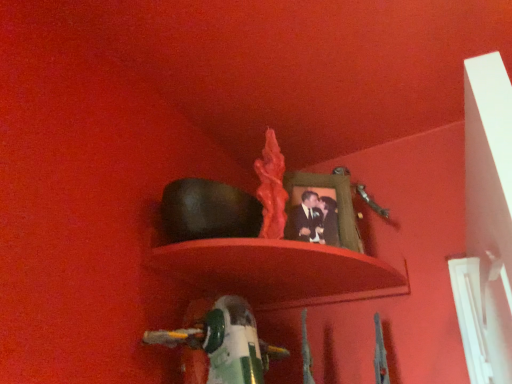
What do you see at coordinates (321, 210) in the screenshot?
I see `matte green picture frame at upper center` at bounding box center [321, 210].

You are a GUI agent. You are given a task and a screenshot of the screen. Output one action in this format:
    pyautogui.click(x=<x>, y=<y>)
    Task: Click on the green plastic toy at lower center
    This screenshot has height=384, width=512.
    Given the screenshot: What is the action you would take?
    pyautogui.click(x=220, y=343)

Does matte green picture frame at upper center come behind green plastic toy at lower center?

Yes.

From the image's perspective, which is below, matte green picture frame at upper center or green plastic toy at lower center?

green plastic toy at lower center, from the image's perspective.

Which object is positioned more to the left, matte green picture frame at upper center or green plastic toy at lower center?

green plastic toy at lower center.

From a real-world perspective, is matte green picture frame at upper center positioned over green plastic toy at lower center based on gravity?

Yes, from a real-world perspective, matte green picture frame at upper center is above green plastic toy at lower center.

Is smooth matte shelf at center oriented towards green plastic toy at lower center?

No, smooth matte shelf at center does not turn towards green plastic toy at lower center.

Which of these two, smooth matte shelf at center or green plastic toy at lower center, stands taller?

green plastic toy at lower center.

Considering the points (290, 201) and (216, 322), which point is in front, point (290, 201) or point (216, 322)?

The point (216, 322) is in front.

In order to click on toy below the matte green picture frame at upper center (from a real-world perspective) in this screenshot , I will do `click(220, 343)`.

From the image's perspective, is green plastic toy at lower center above or below matte green picture frame at upper center?

Based on their image positions, green plastic toy at lower center is located beneath matte green picture frame at upper center.

Which of these two, green plastic toy at lower center or matte green picture frame at upper center, stands shorter?

Result: Standing shorter between the two is green plastic toy at lower center.

Which is more to the right, green plastic toy at lower center or matte green picture frame at upper center?

From the viewer's perspective, matte green picture frame at upper center appears more on the right side.

Is matte green picture frame at upper center not close to smooth matte shelf at center?

matte green picture frame at upper center is near smooth matte shelf at center, not far away.

From the image's perspective, which object appears higher, matte green picture frame at upper center or smooth matte shelf at center?

From the image's view, matte green picture frame at upper center is above.

Is matte green picture frame at upper center spatially inside smooth matte shelf at center, or outside of it?

matte green picture frame at upper center exists outside the volume of smooth matte shelf at center.

Where is `toy on the left of the smooth matte shelf at center`? The image size is (512, 384). toy on the left of the smooth matte shelf at center is located at coordinates (220, 343).

Is the surface of green plastic toy at lower center in direct contact with smooth matte shelf at center?

No, green plastic toy at lower center is not next to smooth matte shelf at center.

Considering the sizes of green plastic toy at lower center and smooth matte shelf at center in the image, is green plastic toy at lower center taller or shorter than smooth matte shelf at center?

Considering their sizes, green plastic toy at lower center has more height than smooth matte shelf at center.

From the image's perspective, is green plastic toy at lower center above or below smooth matte shelf at center?

green plastic toy at lower center is situated lower than smooth matte shelf at center in the image.

Can you confirm if smooth matte shelf at center is positioned to the left of matte green picture frame at upper center?

Indeed, smooth matte shelf at center is positioned on the left side of matte green picture frame at upper center.

Is smooth matte shelf at center looking in the opposite direction of matte green picture frame at upper center?

No.

Who is shorter, smooth matte shelf at center or matte green picture frame at upper center?

Standing shorter between the two is smooth matte shelf at center.

The image size is (512, 384). In order to click on toy directly beneath the matte green picture frame at upper center (from a real-world perspective) in this screenshot , I will do `click(220, 343)`.

Image resolution: width=512 pixels, height=384 pixels. I want to click on shelf that is above the green plastic toy at lower center (from a real-world perspective), so click(x=288, y=255).

From the image, which object appears to be farther from green plastic toy at lower center, smooth matte shelf at center or matte green picture frame at upper center?

matte green picture frame at upper center.

When comparing their distances from matte green picture frame at upper center, does smooth matte shelf at center or green plastic toy at lower center seem further?

Based on the image, green plastic toy at lower center appears to be further to matte green picture frame at upper center.

From the image, which object appears to be nearer to matte green picture frame at upper center, green plastic toy at lower center or smooth matte shelf at center?

smooth matte shelf at center lies closer to matte green picture frame at upper center than the other object.

When comparing their distances from smooth matte shelf at center, does matte green picture frame at upper center or green plastic toy at lower center seem closer?

The object closer to smooth matte shelf at center is matte green picture frame at upper center.

Considering their positions, is green plastic toy at lower center positioned closer to smooth matte shelf at center than matte green picture frame at upper center?

Based on the image, matte green picture frame at upper center appears to be nearer to smooth matte shelf at center.

Considering their positions, is matte green picture frame at upper center positioned closer to green plastic toy at lower center than smooth matte shelf at center?

smooth matte shelf at center is closer to green plastic toy at lower center.

Where is `shelf between matte green picture frame at upper center and green plastic toy at lower center from top to bottom`? shelf between matte green picture frame at upper center and green plastic toy at lower center from top to bottom is located at coordinates (288, 255).